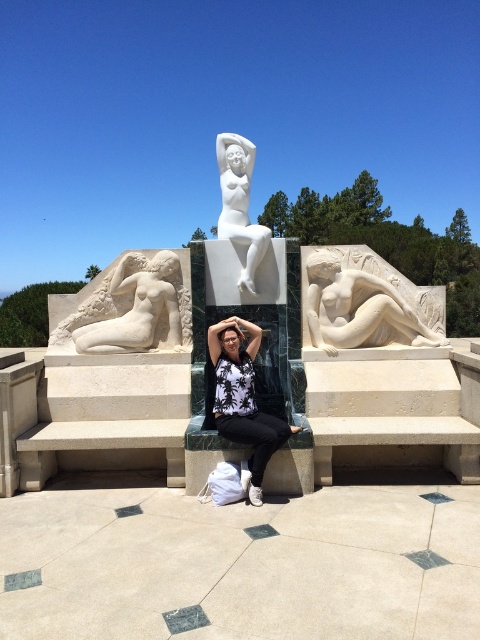
You are standing at point A and want to walk to point B. The path goes through the sculpture installation. Given that point A is at coordinates point (387,276) and point B is at coordinates point (146,305), which direction should you move to reach point B from point A?

To move from point (387,276) to point (146,305), you should move downward and to the right since point B is lower and further to the right compared to point A.

You are an art student observing the sculpture installation. You notice the white fabric bag at center and the white marble reclining figure at left. From your viewpoint, which object is closer to you?

The white fabric bag at center is closer to you because it is positioned in front of the white marble reclining figure at left.

You are standing at point (264, 234) and want to walk to the central white marble statue of a reclining female figure. Is the point (120, 273) between you and the statue?

Point (120, 273) is behind point (264, 234), so it is not between you and the central white marble statue of a reclining female figure.